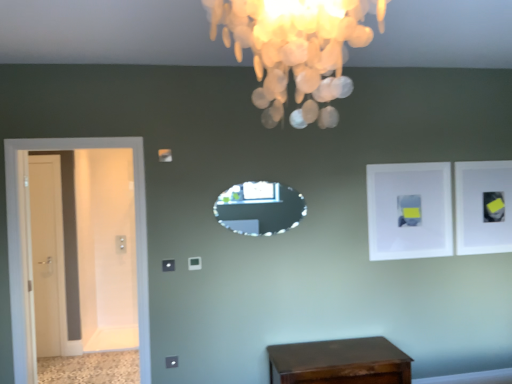
Question: Is white glossy door at left, the first door from the left, outside ivory shell chandelier at upper center?

Choices:
 (A) yes
 (B) no

Answer: (A)

Question: Does white glossy door at left, marked as the second door in a front-to-back arrangement, lie behind ivory shell chandelier at upper center?

Choices:
 (A) no
 (B) yes

Answer: (B)

Question: From a real-world perspective, does white glossy door at left, the first door from the left, stand above ivory shell chandelier at upper center?

Choices:
 (A) yes
 (B) no

Answer: (B)

Question: Is white glossy door at left, the first door from the left, thinner than ivory shell chandelier at upper center?

Choices:
 (A) no
 (B) yes

Answer: (B)

Question: Is white glossy door at left, the second door in the right-to-left sequence, turned away from ivory shell chandelier at upper center?

Choices:
 (A) no
 (B) yes

Answer: (A)

Question: Would you say white matte picture frame at upper right, which appears as the first picture frame when viewed from the left, is to the left or to the right of white matte picture frame at upper right, which is the first picture frame from back to front, in the picture?

Choices:
 (A) left
 (B) right

Answer: (A)

Question: Considering the positions of point (387, 167) and point (498, 246), is point (387, 167) closer or farther from the camera than point (498, 246)?

Choices:
 (A) farther
 (B) closer

Answer: (B)

Question: Looking at the image, does white matte picture frame at upper right, arranged as the 2th picture frame when viewed from the back, seem bigger or smaller compared to white matte picture frame at upper right, which is the first picture frame from back to front?

Choices:
 (A) small
 (B) big

Answer: (A)

Question: From the image's perspective, is white matte picture frame at upper right, which appears as the first picture frame when viewed from the left, positioned above or below white matte picture frame at upper right, which is the first picture frame from back to front?

Choices:
 (A) above
 (B) below

Answer: (B)

Question: From a real-world perspective, is crystal glass mirror at center above or below white matte picture frame at upper right, placed as the 2th picture frame when sorted from right to left?

Choices:
 (A) above
 (B) below

Answer: (A)

Question: Choose the correct answer: Is crystal glass mirror at center inside white matte picture frame at upper right, which is counted as the 1th picture frame, starting from the front, or outside it?

Choices:
 (A) inside
 (B) outside

Answer: (B)

Question: From their relative heights in the image, would you say crystal glass mirror at center is taller or shorter than white matte picture frame at upper right, placed as the 2th picture frame when sorted from right to left?

Choices:
 (A) short
 (B) tall

Answer: (A)

Question: In the image, is crystal glass mirror at center on the left side or the right side of white matte picture frame at upper right, which appears as the first picture frame when viewed from the left?

Choices:
 (A) right
 (B) left

Answer: (B)

Question: From the image's perspective, is white matte picture frame at upper right, which is the 2th picture frame in front-to-back order, positioned above or below ivory shell chandelier at upper center?

Choices:
 (A) below
 (B) above

Answer: (A)

Question: Would you say white matte picture frame at upper right, which is the 1th picture frame in right-to-left order, is to the left or to the right of ivory shell chandelier at upper center in the picture?

Choices:
 (A) left
 (B) right

Answer: (B)